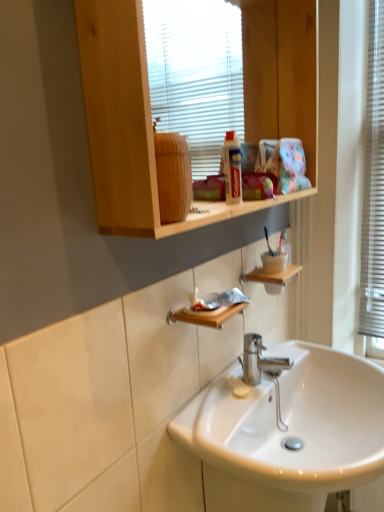
Question: Considering the relative positions of wooden shelf at lower center, the first shelf viewed from the top, and white glossy sink at center in the image provided, is wooden shelf at lower center, the first shelf viewed from the top, to the left of white glossy sink at center from the viewer's perspective?

Choices:
 (A) yes
 (B) no

Answer: (A)

Question: Can you confirm if wooden shelf at lower center, which is the first shelf in right-to-left order, is positioned to the right of white glossy sink at center?

Choices:
 (A) yes
 (B) no

Answer: (B)

Question: Would you say white glossy sink at center is part of wooden shelf at lower center, which is the first shelf in right-to-left order,'s contents?

Choices:
 (A) no
 (B) yes

Answer: (A)

Question: Does wooden shelf at lower center, acting as the second shelf starting from the left, have a lesser height compared to white glossy sink at center?

Choices:
 (A) no
 (B) yes

Answer: (B)

Question: Is white glossy sink at center at the back of wooden shelf at lower center, acting as the second shelf starting from the left?

Choices:
 (A) yes
 (B) no

Answer: (B)

Question: Is the surface of wooden shelf at lower center, the first shelf viewed from the top, in direct contact with white glossy sink at center?

Choices:
 (A) no
 (B) yes

Answer: (A)

Question: Does white glossy sink at center have a greater height compared to wooden shelf at upper center?

Choices:
 (A) no
 (B) yes

Answer: (A)

Question: Is white glossy sink at center located outside wooden shelf at upper center?

Choices:
 (A) yes
 (B) no

Answer: (A)

Question: From the image's perspective, would you say white glossy sink at center is positioned over wooden shelf at upper center?

Choices:
 (A) yes
 (B) no

Answer: (B)

Question: Is white glossy sink at center with wooden shelf at upper center?

Choices:
 (A) no
 (B) yes

Answer: (A)

Question: From a real-world perspective, is white glossy sink at center below wooden shelf at upper center?

Choices:
 (A) no
 (B) yes

Answer: (B)

Question: Is white glossy sink at center to the left of wooden shelf at upper center from the viewer's perspective?

Choices:
 (A) yes
 (B) no

Answer: (B)

Question: Is wooden shelf at upper center bigger than wooden shelf at lower center, the second shelf in the front-to-back sequence?

Choices:
 (A) no
 (B) yes

Answer: (B)